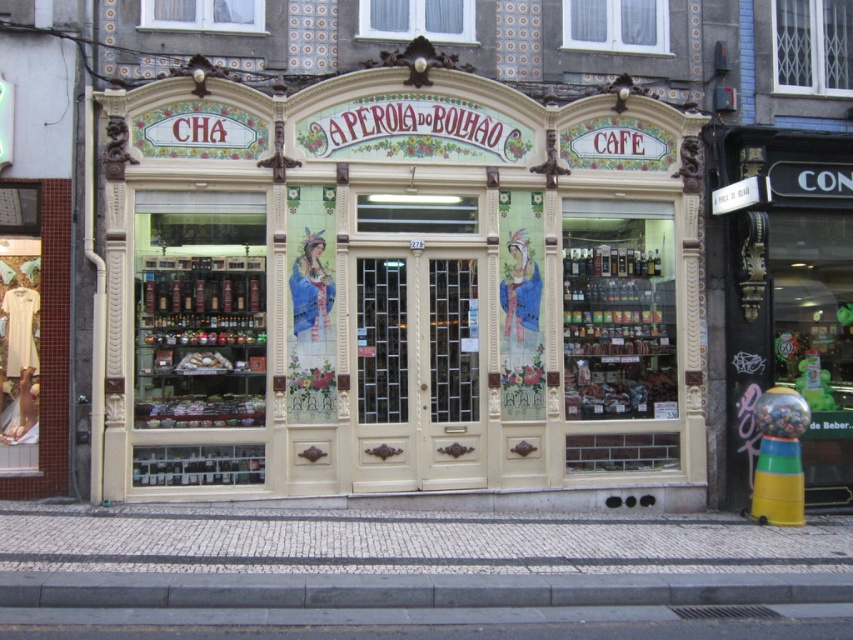
Question: Does white painted wood storefront at center appear on the left side of gray concrete curb at lower center?

Choices:
 (A) no
 (B) yes

Answer: (A)

Question: Does white painted wood storefront at center lie behind gray concrete curb at lower center?

Choices:
 (A) yes
 (B) no

Answer: (A)

Question: Can you confirm if white painted wood storefront at center is positioned above gray concrete curb at lower center?

Choices:
 (A) yes
 (B) no

Answer: (A)